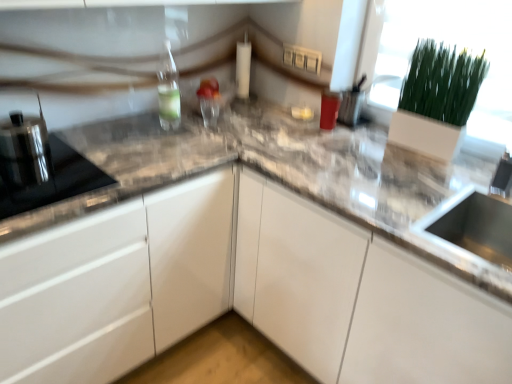
Where is `vacant space to the left of clear glass bottle at upper left`? vacant space to the left of clear glass bottle at upper left is located at coordinates (132, 128).